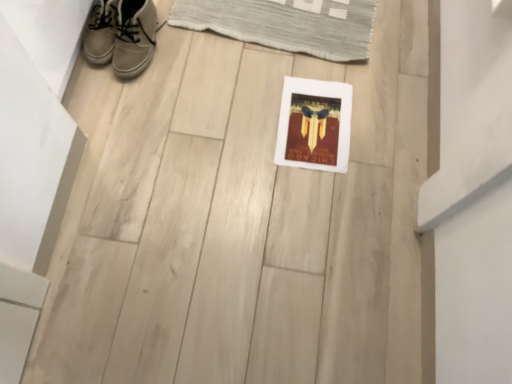
Question: From the image's perspective, would you say leather sneaker at upper left, arranged as the first footwear when viewed from the left, is positioned over white leather sneakers at upper left, which is the 2th footwear from left to right?

Choices:
 (A) no
 (B) yes

Answer: (B)

Question: Could you tell me if leather sneaker at upper left, the 2th footwear in the right-to-left sequence, is turned towards white leather sneakers at upper left, which is the 2th footwear from left to right?

Choices:
 (A) yes
 (B) no

Answer: (A)

Question: Are leather sneaker at upper left, arranged as the first footwear when viewed from the left, and white leather sneakers at upper left, which is the 2th footwear from left to right, located far from each other?

Choices:
 (A) yes
 (B) no

Answer: (B)

Question: Does leather sneaker at upper left, the 2th footwear in the right-to-left sequence, have a greater height compared to white leather sneakers at upper left, which is the 2th footwear from left to right?

Choices:
 (A) yes
 (B) no

Answer: (B)

Question: Is leather sneaker at upper left, the 2th footwear in the right-to-left sequence, closer to camera compared to white leather sneakers at upper left, the first footwear in the right-to-left sequence?

Choices:
 (A) no
 (B) yes

Answer: (A)

Question: From the image's perspective, does leather sneaker at upper left, arranged as the first footwear when viewed from the left, appear lower than white leather sneakers at upper left, which is the 2th footwear from left to right?

Choices:
 (A) yes
 (B) no

Answer: (B)

Question: Can you confirm if leather sneaker at upper left, the 2th footwear in the right-to-left sequence, is bigger than white matte picture frame at center?

Choices:
 (A) yes
 (B) no

Answer: (A)

Question: Does leather sneaker at upper left, arranged as the first footwear when viewed from the left, have a greater width compared to white matte picture frame at center?

Choices:
 (A) no
 (B) yes

Answer: (A)

Question: From a real-world perspective, is leather sneaker at upper left, arranged as the first footwear when viewed from the left, positioned under white matte picture frame at center based on gravity?

Choices:
 (A) no
 (B) yes

Answer: (A)

Question: Is the depth of leather sneaker at upper left, the 2th footwear in the right-to-left sequence, less than that of white matte picture frame at center?

Choices:
 (A) no
 (B) yes

Answer: (B)

Question: Is leather sneaker at upper left, arranged as the first footwear when viewed from the left, outside white matte picture frame at center?

Choices:
 (A) no
 (B) yes

Answer: (B)

Question: Is white matte picture frame at center located within leather sneaker at upper left, the 2th footwear in the right-to-left sequence?

Choices:
 (A) yes
 (B) no

Answer: (B)

Question: Can you see white matte picture frame at center touching leather sneaker at upper left, arranged as the first footwear when viewed from the left?

Choices:
 (A) no
 (B) yes

Answer: (A)